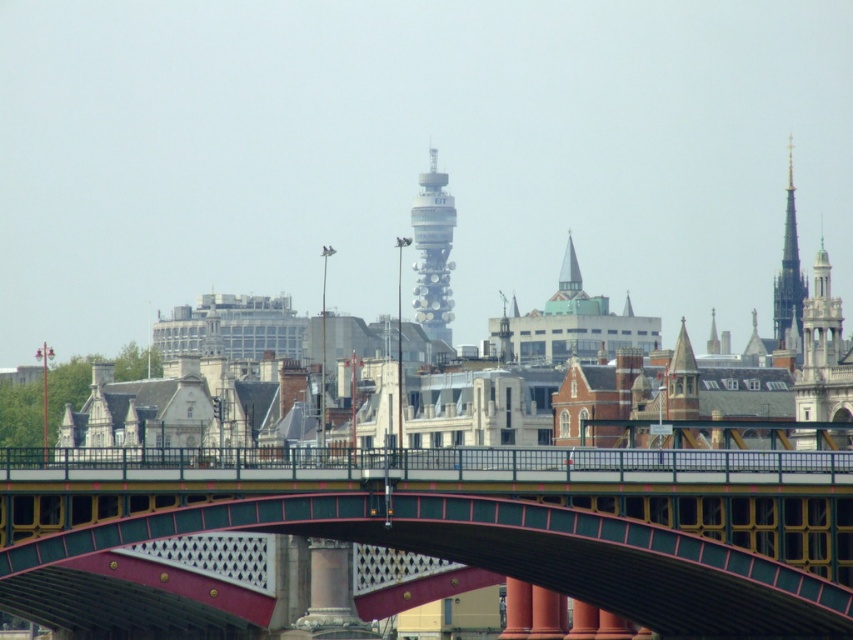
Question: Which is nearer to the metallic red bridge at center?

Choices:
 (A) silver metallic bt tower at center
 (B) golden spire at upper right

Answer: (B)

Question: Can you confirm if metallic red bridge at center is positioned above silver metallic bt tower at center?

Choices:
 (A) yes
 (B) no

Answer: (B)

Question: Which of the following is the farthest from the observer?

Choices:
 (A) (813, 312)
 (B) (422, 282)

Answer: (B)

Question: Which point is closer to the camera taking this photo?

Choices:
 (A) (412, 289)
 (B) (792, 224)
 (C) (840, 308)
 (D) (752, 454)

Answer: (D)

Question: Considering the relative positions of metallic red bridge at center and gold textured spire at upper right in the image provided, where is metallic red bridge at center located with respect to gold textured spire at upper right?

Choices:
 (A) below
 (B) above

Answer: (A)

Question: Is metallic red bridge at center to the right of gold textured spire at upper right from the viewer's perspective?

Choices:
 (A) no
 (B) yes

Answer: (A)